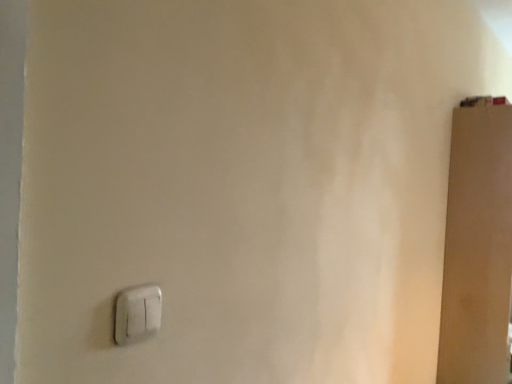
Question: From the image's perspective, is white plastic light switch at lower left above or below brown matte door at right?

Choices:
 (A) above
 (B) below

Answer: (A)

Question: In the image, is white plastic light switch at lower left positioned in front of or behind brown matte door at right?

Choices:
 (A) behind
 (B) front

Answer: (B)

Question: Is white plastic light switch at lower left wider or thinner than brown matte door at right?

Choices:
 (A) wide
 (B) thin

Answer: (B)

Question: From a real-world perspective, is brown matte door at right positioned above or below white plastic light switch at lower left?

Choices:
 (A) below
 (B) above

Answer: (A)

Question: Considering their positions, is brown matte door at right located in front of or behind white plastic light switch at lower left?

Choices:
 (A) behind
 (B) front

Answer: (A)

Question: From the image's perspective, is brown matte door at right located above or below white plastic light switch at lower left?

Choices:
 (A) above
 (B) below

Answer: (B)

Question: Considering the positions of brown matte door at right and white plastic light switch at lower left in the image, is brown matte door at right wider or thinner than white plastic light switch at lower left?

Choices:
 (A) wide
 (B) thin

Answer: (A)